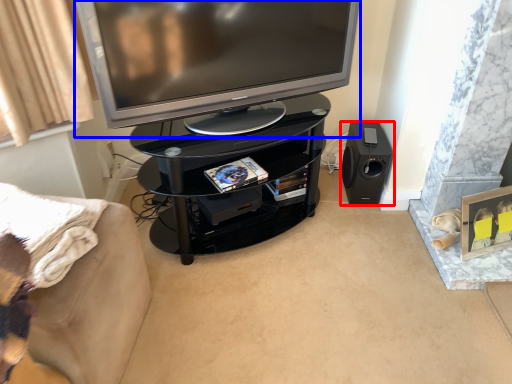
Question: Which object appears closest to the camera in this image, loudspeaker (highlighted by a red box) or television (highlighted by a blue box)?

Choices:
 (A) loudspeaker
 (B) television

Answer: (B)